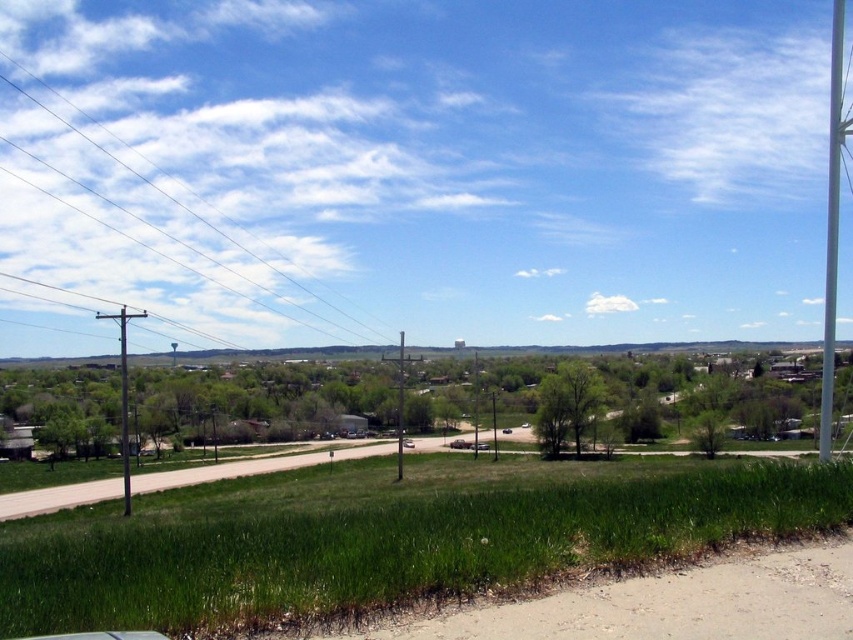
Question: Is smooth wire at upper left behind metallic gray utility pole at left?

Choices:
 (A) no
 (B) yes

Answer: (B)

Question: Where is smooth wire at upper left located in relation to brown wooden telegraph pole at left in the image?

Choices:
 (A) right
 (B) left

Answer: (B)

Question: Can you confirm if brown wooden telegraph pole at left is positioned above metallic gray utility pole at left?

Choices:
 (A) yes
 (B) no

Answer: (B)

Question: Among these points, which one is farthest from the camera?

Choices:
 (A) (396, 362)
 (B) (125, 461)
 (C) (288, 278)
 (D) (125, 420)

Answer: (C)

Question: Estimate the real-world distances between objects in this image. Which object is closer to the metallic gray utility pole at left?

Choices:
 (A) black metal pole at center
 (B) brown wooden telegraph pole at left
 (C) smooth wire at upper left

Answer: (B)

Question: Considering the real-world distances, which object is farthest from the metallic gray utility pole at left?

Choices:
 (A) smooth wire at upper left
 (B) black metal pole at center

Answer: (A)